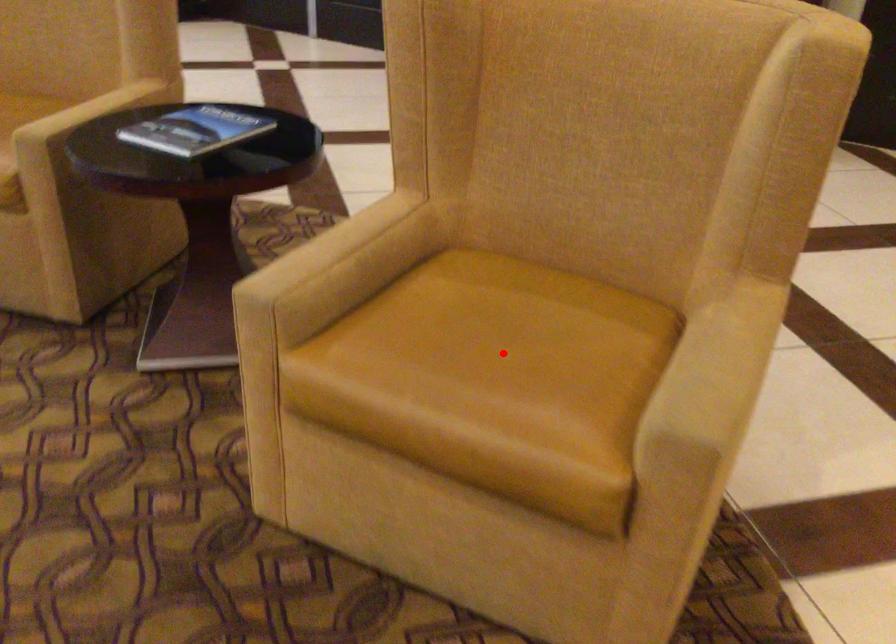
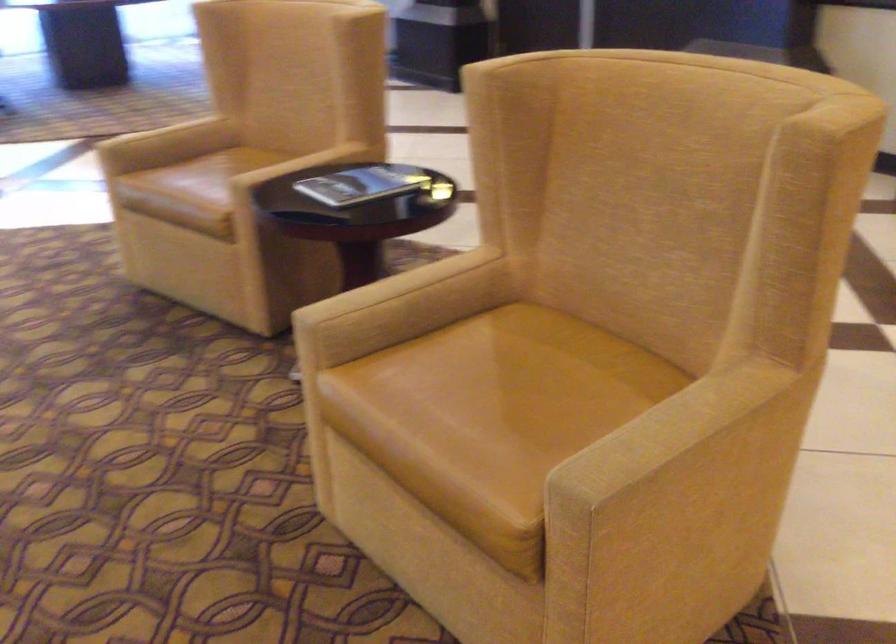
Find the pixel in the second image that matches the highlighted location in the first image.

(500, 398)